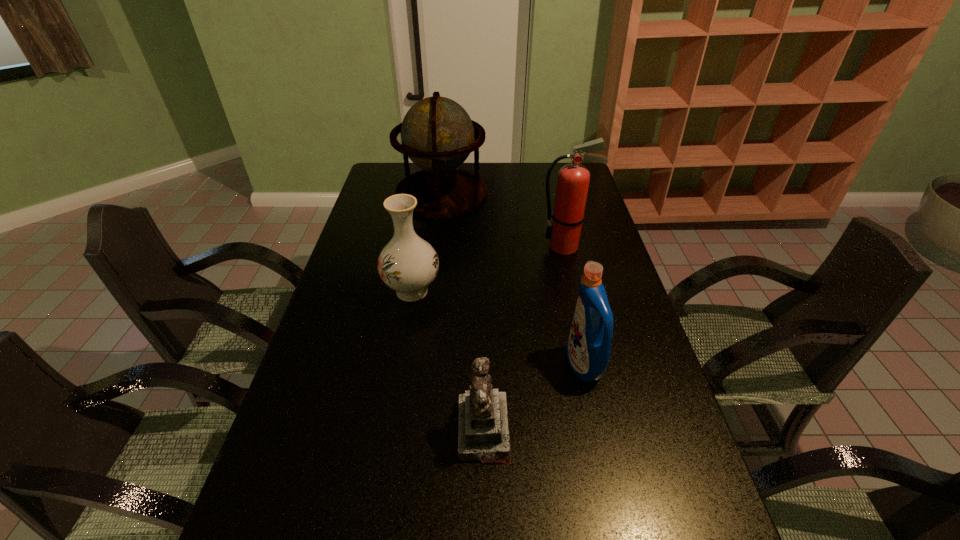
Find the location of `fire extinguisher situated at the right edge`. fire extinguisher situated at the right edge is located at coordinates (573, 180).

The height and width of the screenshot is (540, 960). I want to click on detergent located in the right edge section of the desktop, so click(588, 348).

Image resolution: width=960 pixels, height=540 pixels. In order to click on object situated at the far left corner in this screenshot , I will do tap(437, 134).

Locate an element on the screen. The height and width of the screenshot is (540, 960). free space at the far edge is located at coordinates (532, 186).

You are a GUI agent. You are given a task and a screenshot of the screen. Output one action in this format:
    pyautogui.click(x=<x>, y=<y>)
    Task: Click on the vacant position at the left edge of the desktop
    
    Given the screenshot: What is the action you would take?
    pyautogui.click(x=303, y=534)

Locate an element on the screen. The image size is (960, 540). vacant space at the right edge is located at coordinates coord(612,302).

Locate an element on the screen. vacant region at the far left corner of the desktop is located at coordinates (x=382, y=166).

This screenshot has width=960, height=540. Identify the location of free space at the far right corner of the desktop. (555, 178).

At what (x,y) coordinates should I click in order to perform the action: click on vacant space in between the globe and the second nearest object. Please return your answer as a coordinate pair (x, y). This screenshot has width=960, height=540. Looking at the image, I should click on (513, 279).

In order to click on free point between the shortest object and the third nearest object in this screenshot , I will do `click(448, 361)`.